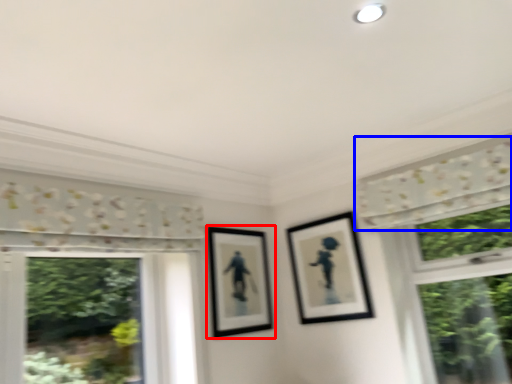
Question: Among these objects, which one is nearest to the camera, picture frame (highlighted by a red box) or curtain (highlighted by a blue box)?

Choices:
 (A) picture frame
 (B) curtain

Answer: (B)